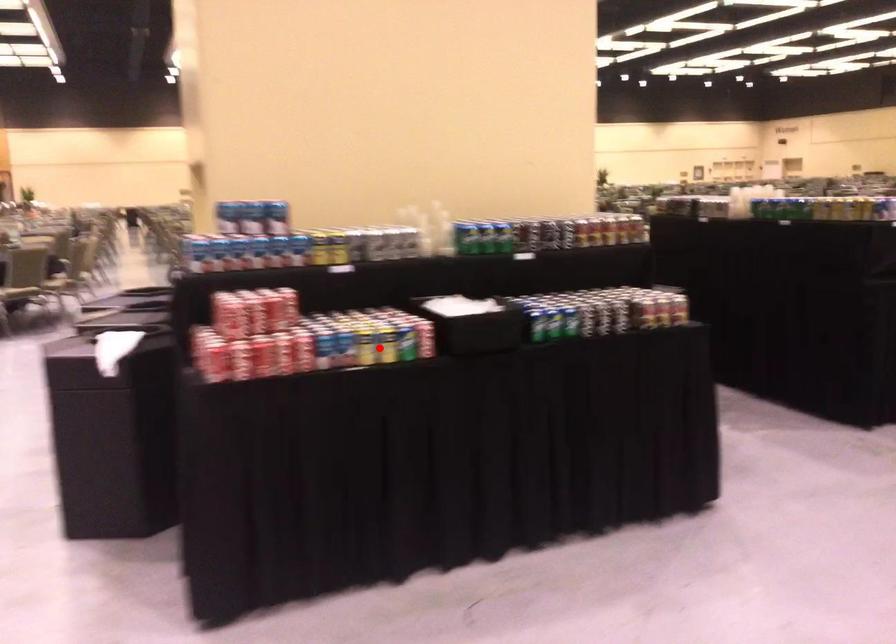
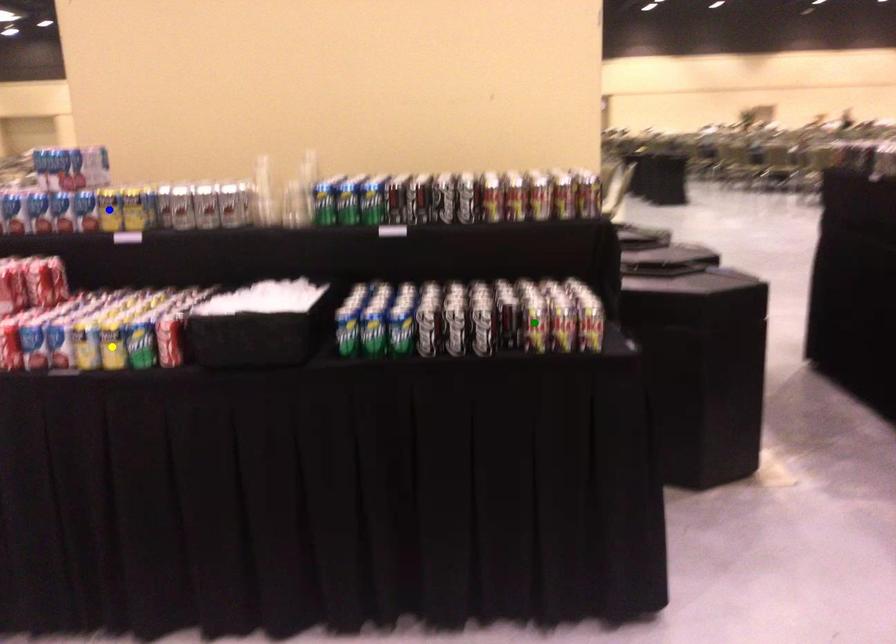
Question: I am providing you with two images of the same scene from different viewpoints. A red point is marked on the first image. You are given multiple points on the second image. Which point in image 2 is actually the same real-world point as the red point in image 1?

Choices:
 (A) green point
 (B) yellow point
 (C) blue point

Answer: (B)